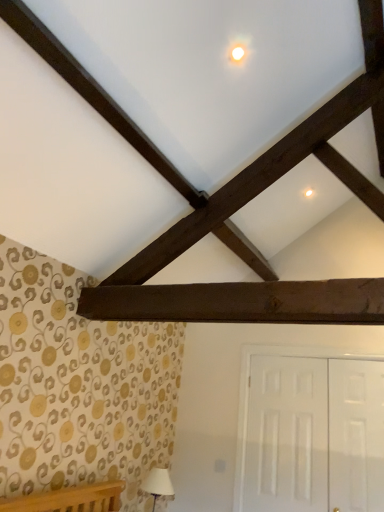
Question: Is white glossy door at lower right, which appears as the second door when viewed from the right, outside of white fabric lampshade at lower left?

Choices:
 (A) no
 (B) yes

Answer: (B)

Question: Is white glossy door at lower right, the 1th door when ordered from left to right, at the left side of white fabric lampshade at lower left?

Choices:
 (A) no
 (B) yes

Answer: (A)

Question: Considering the relative sizes of white glossy door at lower right, the 1th door when ordered from left to right, and white fabric lampshade at lower left in the image provided, is white glossy door at lower right, the 1th door when ordered from left to right, bigger than white fabric lampshade at lower left?

Choices:
 (A) no
 (B) yes

Answer: (B)

Question: From a real-world perspective, is white glossy door at lower right, which appears as the second door when viewed from the right, on top of white fabric lampshade at lower left?

Choices:
 (A) no
 (B) yes

Answer: (B)

Question: Considering the relative positions of white glossy door at lower right, the 1th door when ordered from left to right, and white fabric lampshade at lower left in the image provided, is white glossy door at lower right, the 1th door when ordered from left to right, behind white fabric lampshade at lower left?

Choices:
 (A) no
 (B) yes

Answer: (A)

Question: Considering the relative sizes of white glossy door at lower right, the 1th door when ordered from left to right, and white fabric lampshade at lower left in the image provided, is white glossy door at lower right, the 1th door when ordered from left to right, taller than white fabric lampshade at lower left?

Choices:
 (A) yes
 (B) no

Answer: (A)

Question: Can you confirm if white glossy door at lower right, which appears as the second door when viewed from the right, is smaller than dark brown wood plank at center?

Choices:
 (A) no
 (B) yes

Answer: (A)

Question: Considering the relative sizes of white glossy door at lower right, the 1th door when ordered from left to right, and dark brown wood plank at center in the image provided, is white glossy door at lower right, the 1th door when ordered from left to right, thinner than dark brown wood plank at center?

Choices:
 (A) no
 (B) yes

Answer: (B)

Question: Is the depth of white glossy door at lower right, the 1th door when ordered from left to right, less than that of dark brown wood plank at center?

Choices:
 (A) no
 (B) yes

Answer: (A)

Question: From the image's perspective, is white glossy door at lower right, which appears as the second door when viewed from the right, on dark brown wood plank at center?

Choices:
 (A) yes
 (B) no

Answer: (B)

Question: Is white glossy door at lower right, which appears as the second door when viewed from the right, directly adjacent to dark brown wood plank at center?

Choices:
 (A) yes
 (B) no

Answer: (B)

Question: From a real-world perspective, is white glossy door at lower right, the 1th door when ordered from left to right, on top of dark brown wood plank at center?

Choices:
 (A) no
 (B) yes

Answer: (A)

Question: Does white glossy door at right, the second door when ordered from left to right, have a greater height compared to white glossy door at lower right, which appears as the second door when viewed from the right?

Choices:
 (A) no
 (B) yes

Answer: (A)